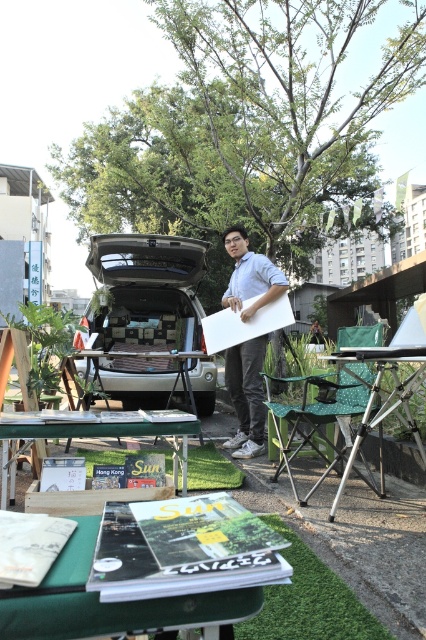
Can you confirm if green fabric table at lower center is positioned to the left of matte white board at center?

Yes, green fabric table at lower center is to the left of matte white board at center.

Is point (48, 621) in front of point (241, 250)?

Yes, it is in front of point (241, 250).

Find the location of a particular element. green fabric table at lower center is located at coordinates [106, 604].

Does teal fabric folding chair at center lie in front of metallic tripod table at lower right?

No, it is behind metallic tripod table at lower right.

Looking at this image, measure the distance between teal fabric folding chair at center and metallic tripod table at lower right.

11.31 inches

Between point (267, 401) and point (414, 422), which one is positioned behind?

Positioned behind is point (267, 401).

The height and width of the screenshot is (640, 426). Identify the location of teal fabric folding chair at center. (316, 416).

Who is more distant from viewer, (242, 349) or (0, 426)?

The point (242, 349) is behind.

Is matte white board at center positioned at the back of green wooden table at lower left?

Yes.

You are a GUI agent. You are given a task and a screenshot of the screen. Output one action in this format:
    pyautogui.click(x=<x>, y=<y>)
    Task: Click on the matte white board at center
    
    Given the screenshot: What is the action you would take?
    pyautogui.click(x=247, y=396)